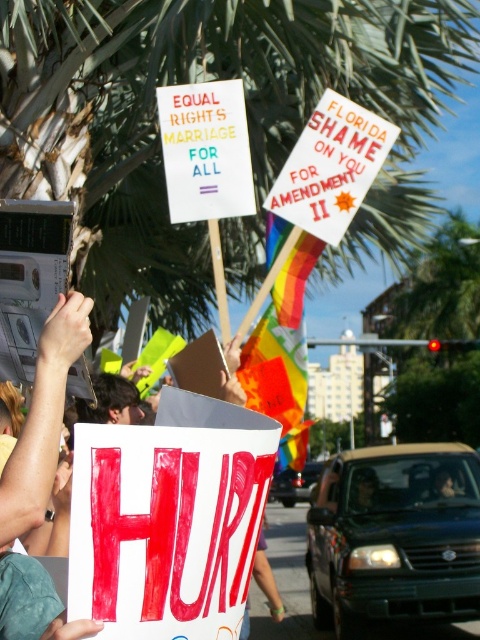
Does point (23, 93) come closer to viewer compared to point (7, 520)?

No.

Does green leafy palm tree at upper center have a greater width compared to white paper sign at center?

Yes.

Image resolution: width=480 pixels, height=640 pixels. Describe the element at coordinates (247, 115) in the screenshot. I see `green leafy palm tree at upper center` at that location.

You are a GUI agent. You are given a task and a screenshot of the screen. Output one action in this format:
    pyautogui.click(x=<x>, y=<y>)
    Task: Click on the green leafy palm tree at upper center
    
    Given the screenshot: What is the action you would take?
    pyautogui.click(x=247, y=115)

Describe the element at coordinates (247, 115) in the screenshot. The width and height of the screenshot is (480, 640). I see `green leafy palm tree at upper center` at that location.

Who is more distant from viewer, (x=13, y=24) or (x=229, y=208)?

Point (x=13, y=24)

Where is `green leafy palm tree at upper center`? green leafy palm tree at upper center is located at coordinates (247, 115).

Between point (16, 588) and point (230, 168), which one is positioned in front?

Positioned in front is point (16, 588).

Is white paper sign at center thinner than white paper sign at upper center?

Yes, white paper sign at center is thinner than white paper sign at upper center.

Is point (39, 637) farther from viewer compared to point (195, 125)?

No, (39, 637) is in front of (195, 125).

The width and height of the screenshot is (480, 640). What are the coordinates of `white paper sign at center` in the screenshot? It's located at (39, 483).